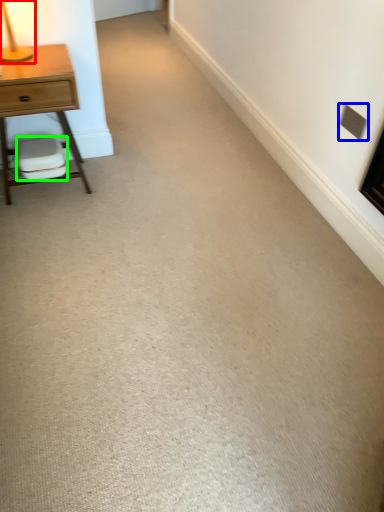
Question: Which object is the farthest from table lamp (highlighted by a red box)? Choose among these: electric outlet (highlighted by a blue box) or swivel chair (highlighted by a green box).

Choices:
 (A) electric outlet
 (B) swivel chair

Answer: (A)